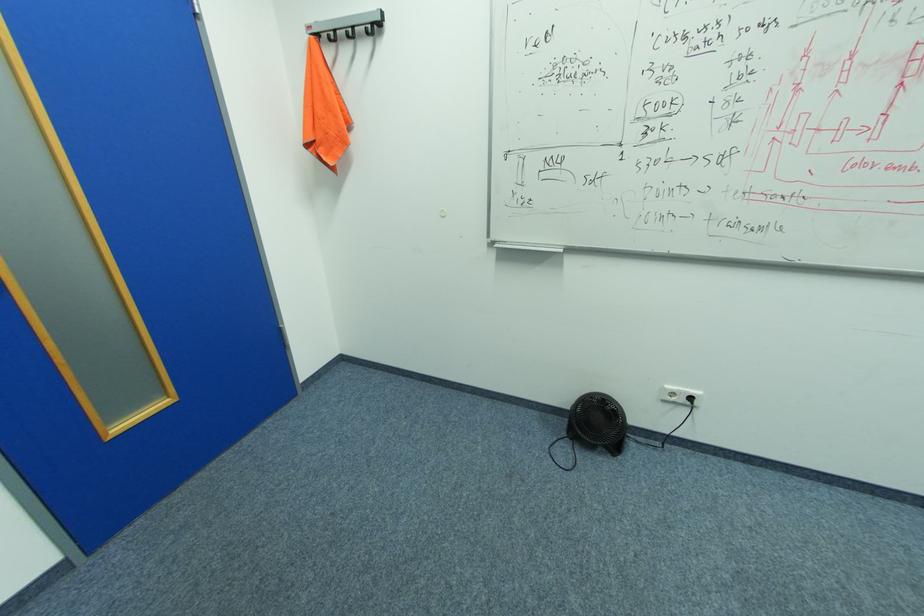
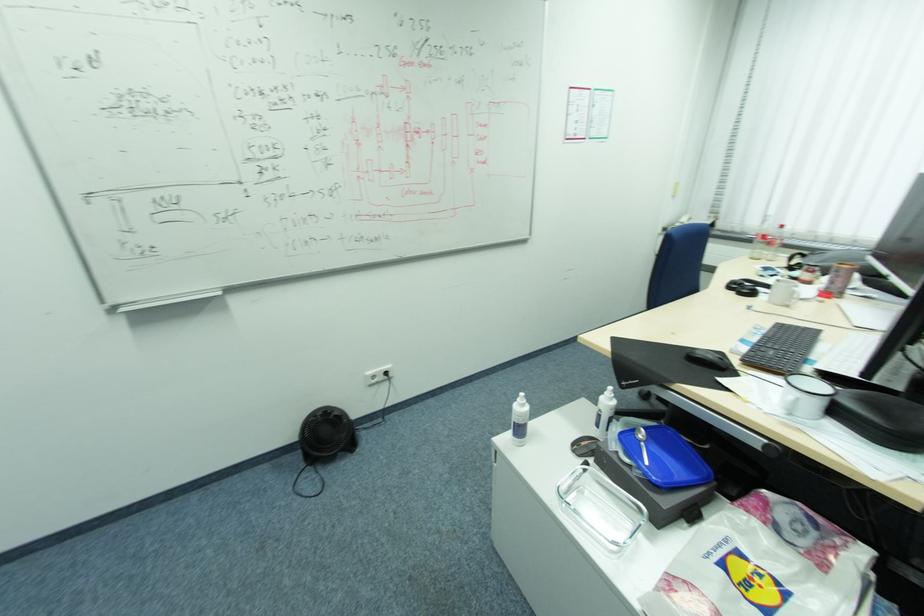
Locate, in the second image, the point that corresponds to point (568, 423) in the first image.

(304, 456)